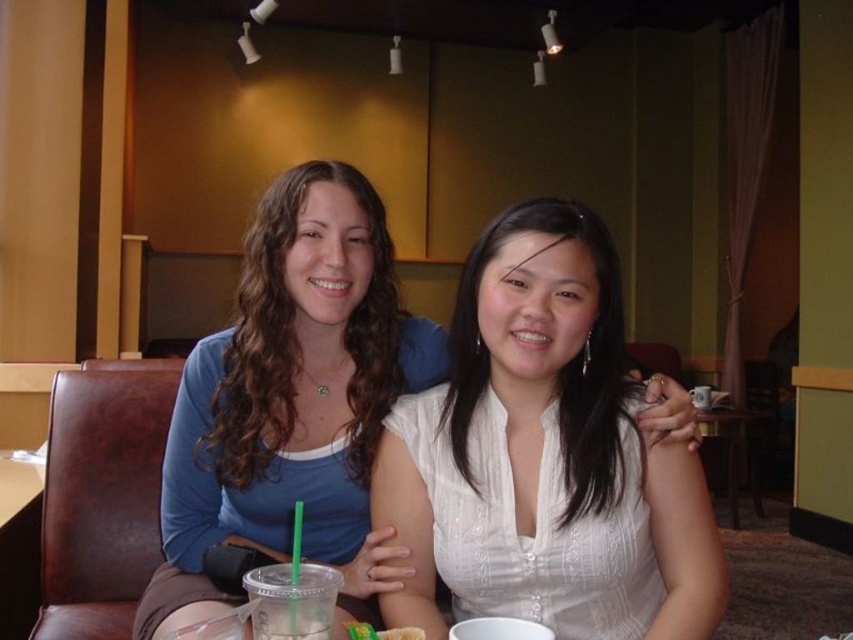
What is located at the coordinates point (544, 456)?

The white satin blouse at center is located at point (544, 456).

You are a waiter at a cafe and need to place a new order of a small dessert on the wooden table at center. Where should you place it so that it doesn not block the clear plastic cup at center?

The clear plastic cup at center is on the left side of the wooden table at center, so placing the dessert on the right side of the wooden table at center would avoid blocking it.

You are a photographer positioned at the origin point of the image. You want to focus your camera on the white satin blouse at center. What are the coordinates where you should aim your camera?

The coordinates to focus on the white satin blouse at center are at point (544,456).